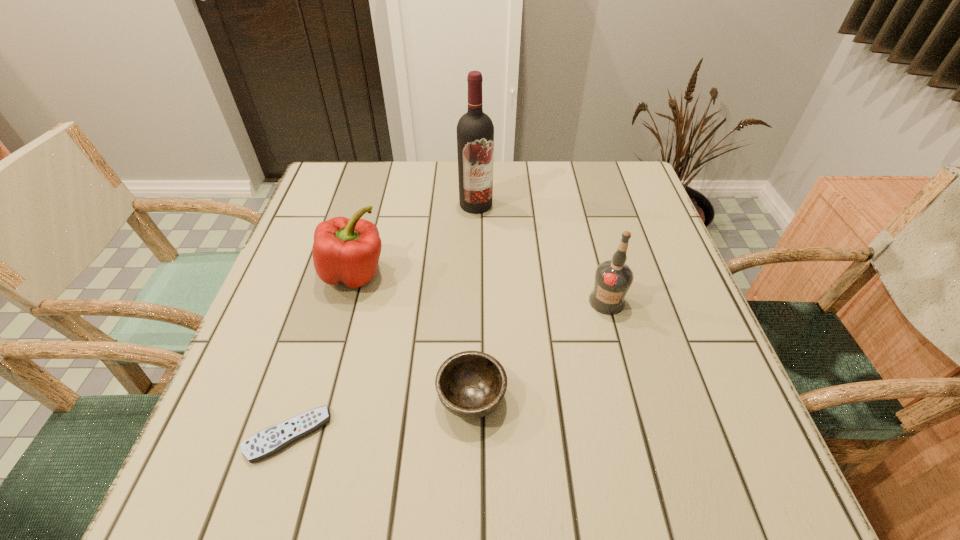
Identify the location of the tallest object. (475, 131).

Find the location of `the farthest object`. the farthest object is located at coordinates (475, 131).

At what (x,y) coordinates should I click in order to perform the action: click on vodka. Please return your answer as a coordinate pair (x, y). The width and height of the screenshot is (960, 540). Looking at the image, I should click on (613, 278).

At what (x,y) coordinates should I click in order to perform the action: click on the second tallest object. Please return your answer as a coordinate pair (x, y). Looking at the image, I should click on (613, 278).

Where is `bell pepper`? bell pepper is located at coordinates (347, 251).

Identify the location of bowl. (471, 384).

In order to click on the shortest object in this screenshot , I will do `click(265, 443)`.

Locate an element on the screen. This screenshot has width=960, height=540. free space located 0.400m on the label of the wine bottle is located at coordinates (474, 339).

I want to click on vacant space located 0.140m on the front label of the fourth shortest object, so click(x=626, y=374).

Locate an element on the screen. vacant region located on the back of the bell pepper is located at coordinates (368, 227).